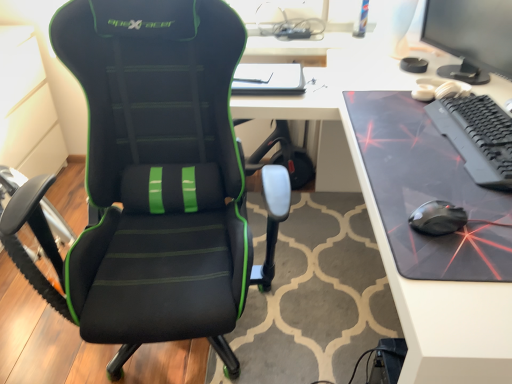
Identify the location of vacant point above transparent plastic mousepad at right (from a real-world perspective). Image resolution: width=512 pixels, height=384 pixels. (406, 137).